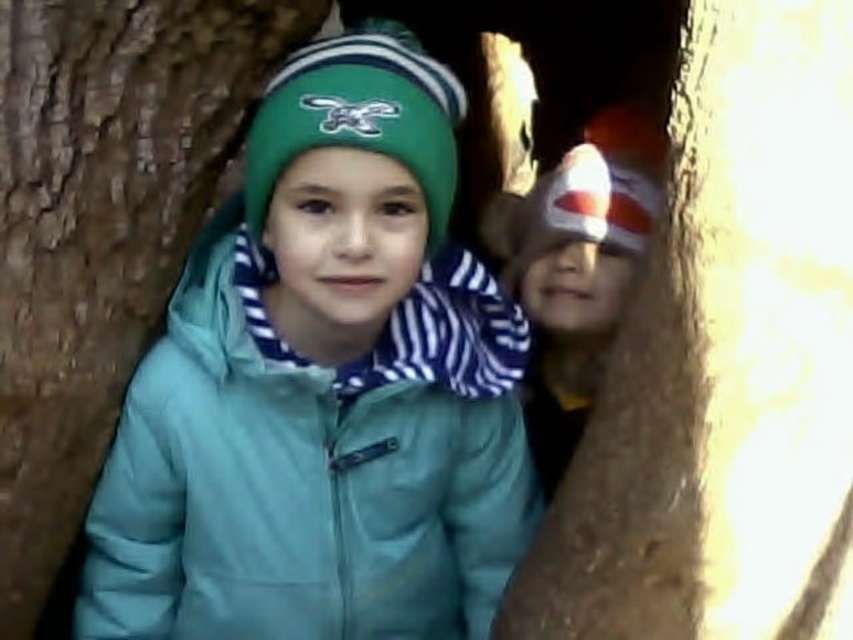
Question: Among these objects, which one is nearest to the camera?

Choices:
 (A) matte plastic toy at center
 (B) teal matte jacket at center
 (C) brown rough bark at right

Answer: (C)

Question: Based on their relative distances, which object is farther from the teal matte jacket at center?

Choices:
 (A) brown rough tree trunk at left
 (B) matte plastic toy at center

Answer: (B)

Question: Can you confirm if brown rough tree trunk at left is smaller than matte plastic toy at center?

Choices:
 (A) no
 (B) yes

Answer: (B)

Question: Does teal matte jacket at center appear over brown rough tree trunk at left?

Choices:
 (A) yes
 (B) no

Answer: (B)

Question: Is brown rough bark at right positioned behind brown rough tree trunk at left?

Choices:
 (A) no
 (B) yes

Answer: (A)

Question: Which of the following is the farthest from the observer?

Choices:
 (A) (120, 508)
 (B) (602, 141)
 (C) (137, 353)

Answer: (B)